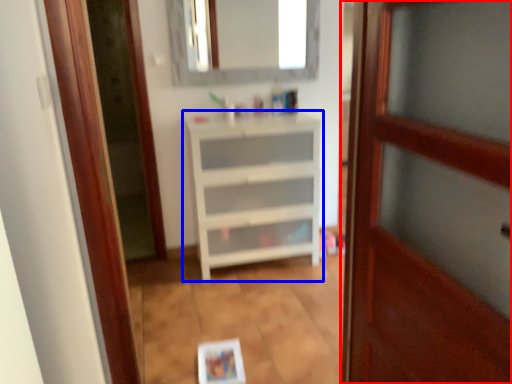
Question: Which object is further to the camera taking this photo, door (highlighted by a red box) or chest of drawers (highlighted by a blue box)?

Choices:
 (A) door
 (B) chest of drawers

Answer: (B)